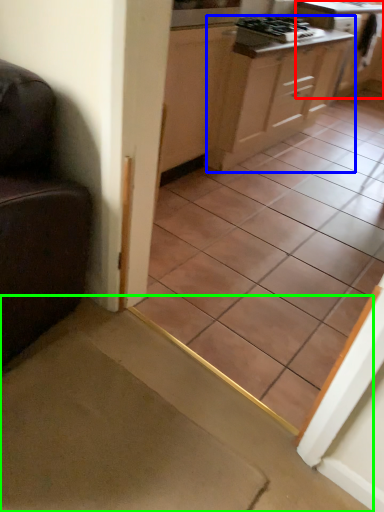
Question: Based on their relative distances, which object is farther from cabinetry (highlighted by a red box)? Choose from cabinetry (highlighted by a blue box) and stairwell (highlighted by a green box).

Choices:
 (A) cabinetry
 (B) stairwell

Answer: (B)